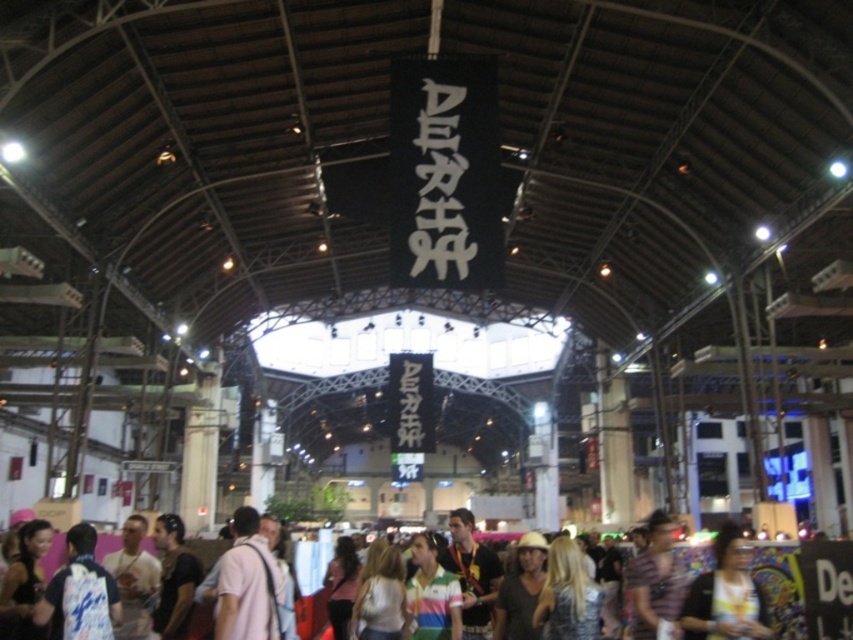
You are standing in the industrial venue and want to move from the point at coordinates [270,577] to the point at [718,628]. Can you walk directly towards the second point without needing to go around any obstacles?

Point [270,577] is behind point [718,628], so you cannot walk directly towards the second point without going around it since the first point is located behind the second one.